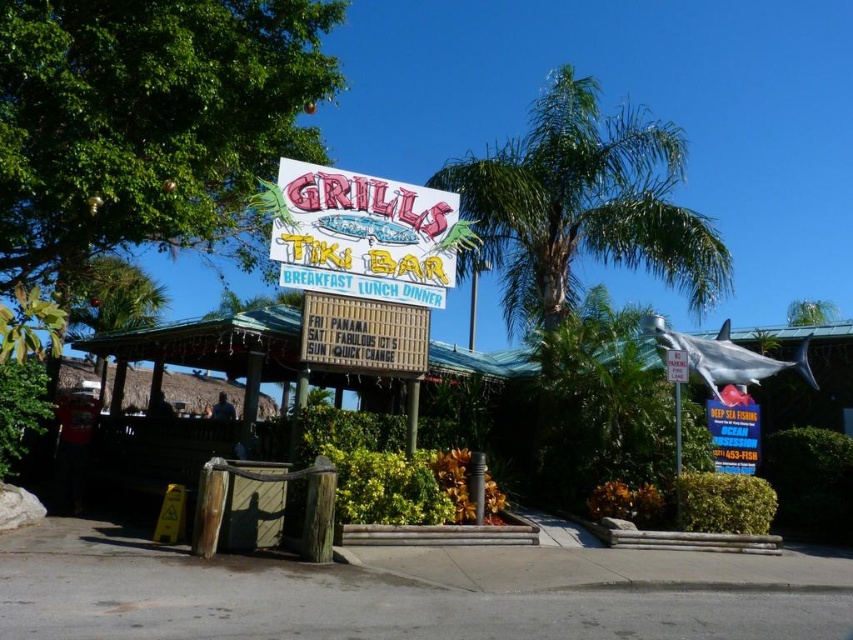
Question: Which object is closer to the camera taking this photo?

Choices:
 (A) wooden sign at center
 (B) blue neon sign at upper right
 (C) white plastic sign at upper center
 (D) white plastic signboard at center

Answer: (D)

Question: Among these points, which one is nearest to the camera?

Choices:
 (A) (573, 108)
 (B) (344, 268)
 (C) (393, 346)
 (D) (680, 349)

Answer: (B)

Question: Is the position of wooden sign at center more distant than that of white plastic sign at upper center?

Choices:
 (A) no
 (B) yes

Answer: (A)

Question: Is green leafy palm tree at center to the right of blue neon sign at upper right from the viewer's perspective?

Choices:
 (A) yes
 (B) no

Answer: (B)

Question: Among these points, which one is nearest to the camera?

Choices:
 (A) (305, 177)
 (B) (547, 150)
 (C) (680, 376)

Answer: (A)

Question: Can you confirm if green leafy palm tree at center is smaller than white plastic signboard at center?

Choices:
 (A) yes
 (B) no

Answer: (B)